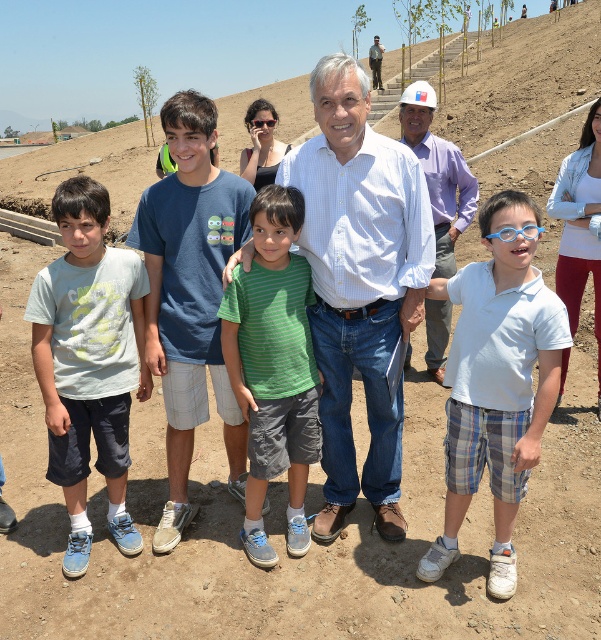
Is light gray cotton t-shirt at left closer to camera compared to green striped shirt at center?

Yes, it is in front of green striped shirt at center.

Who is more forward, (106,340) or (248,320)?

Positioned in front is point (248,320).

The image size is (601, 640). Find the location of `light gray cotton t-shirt at left`. light gray cotton t-shirt at left is located at coordinates click(x=88, y=362).

Can you confirm if white checkered shirt at center is bigger than matte white hard hat at center?

Indeed, white checkered shirt at center has a larger size compared to matte white hard hat at center.

Image resolution: width=601 pixels, height=640 pixels. What do you see at coordinates (359, 284) in the screenshot?
I see `white checkered shirt at center` at bounding box center [359, 284].

Identify the location of white checkered shirt at center. (359, 284).

Can you confirm if white cotton polo shirt at center is positioned above matte white hard hat at center?

Actually, white cotton polo shirt at center is below matte white hard hat at center.

What are the coordinates of `white cotton polo shirt at center` in the screenshot? It's located at (498, 380).

Identify the location of white cotton polo shirt at center. The image size is (601, 640). (498, 380).